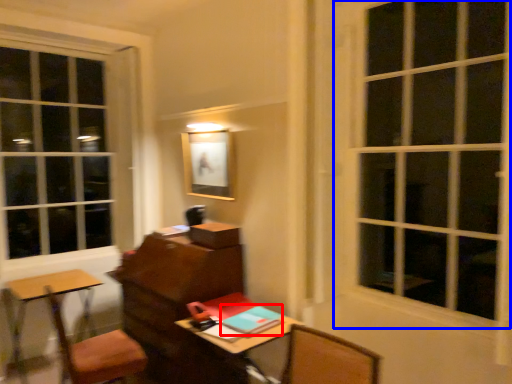
Question: Which of the following is the farthest to the observer, notebook (highlighted by a red box) or window (highlighted by a blue box)?

Choices:
 (A) notebook
 (B) window

Answer: (A)